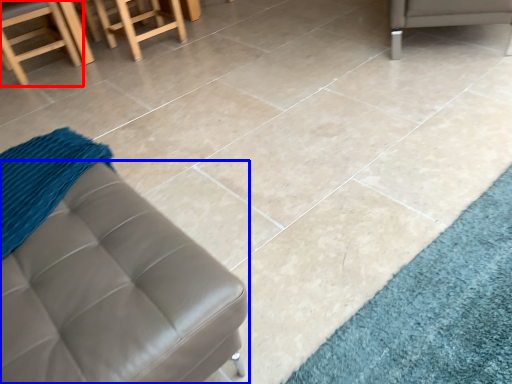
Question: Which point is closer to the camera, chair (highlighted by a red box) or furniture (highlighted by a blue box)?

Choices:
 (A) chair
 (B) furniture

Answer: (B)